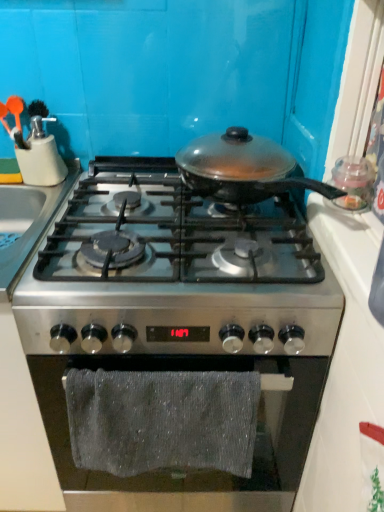
Question: In the image, is stainless steel gas stove at center, the second gas stove ordered from the bottom, positioned in front of or behind gray textured towel at lower center?

Choices:
 (A) behind
 (B) front

Answer: (B)

Question: From their relative heights in the image, would you say stainless steel gas stove at center, the second gas stove ordered from the bottom, is taller or shorter than gray textured towel at lower center?

Choices:
 (A) tall
 (B) short

Answer: (B)

Question: Which is nearer to the stainless steel gas stove at center, which is the first gas stove in top-to-bottom order?

Choices:
 (A) matte plastic utensil holder at upper left
 (B) stainless steel gas stove at center, which is the 2th gas stove from top to bottom
 (C) gray textured towel at lower center

Answer: (B)

Question: Which of these objects is positioned closest to the stainless steel gas stove at center, the second gas stove ordered from the bottom?

Choices:
 (A) matte plastic utensil holder at upper left
 (B) stainless steel gas stove at center, which is the 2th gas stove from top to bottom
 (C) gray textured towel at lower center

Answer: (B)